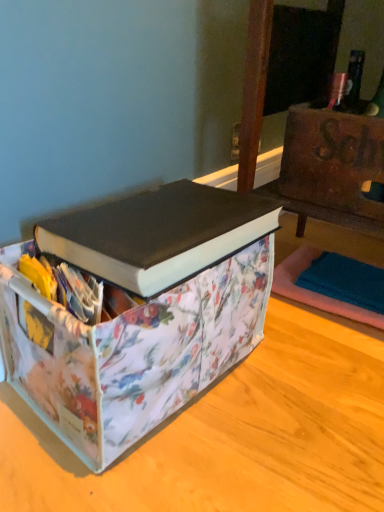
Question: Is black matte book at center far away from floral fabric storage bin at center?

Choices:
 (A) no
 (B) yes

Answer: (A)

Question: Is black matte book at center bigger than floral fabric storage bin at center?

Choices:
 (A) yes
 (B) no

Answer: (B)

Question: Can you confirm if black matte book at center is thinner than floral fabric storage bin at center?

Choices:
 (A) yes
 (B) no

Answer: (A)

Question: Does black matte book at center have a lesser height compared to floral fabric storage bin at center?

Choices:
 (A) no
 (B) yes

Answer: (B)

Question: Is floral fabric storage bin at center a part of black matte book at center?

Choices:
 (A) yes
 (B) no

Answer: (B)

Question: From the image's perspective, is black matte book at center beneath floral fabric storage bin at center?

Choices:
 (A) no
 (B) yes

Answer: (A)

Question: Is floral fabric storage bin at center positioned with its back to black matte book at center?

Choices:
 (A) yes
 (B) no

Answer: (B)

Question: Is the position of floral fabric storage bin at center less distant than that of black matte book at center?

Choices:
 (A) yes
 (B) no

Answer: (A)

Question: From the image's perspective, is floral fabric storage bin at center located beneath black matte book at center?

Choices:
 (A) yes
 (B) no

Answer: (A)

Question: Is floral fabric storage bin at center outside of black matte book at center?

Choices:
 (A) yes
 (B) no

Answer: (A)

Question: Is floral fabric storage bin at center to the left of black matte book at center from the viewer's perspective?

Choices:
 (A) no
 (B) yes

Answer: (B)

Question: Considering the relative sizes of floral fabric storage bin at center and black matte book at center in the image provided, is floral fabric storage bin at center taller than black matte book at center?

Choices:
 (A) yes
 (B) no

Answer: (A)

Question: Is black matte book at center taller or shorter than floral fabric storage bin at center?

Choices:
 (A) short
 (B) tall

Answer: (A)